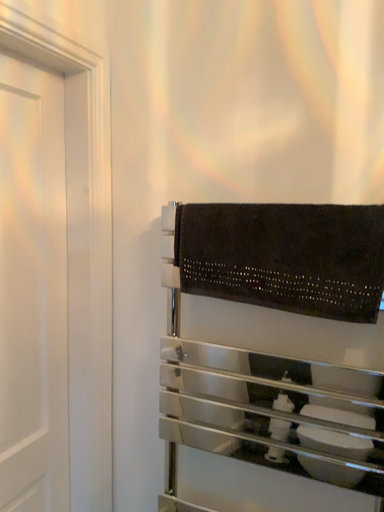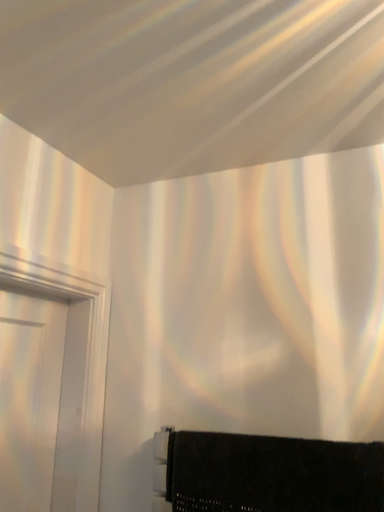
Question: Which way did the camera rotate in the video?

Choices:
 (A) rotated upward
 (B) rotated downward

Answer: (A)